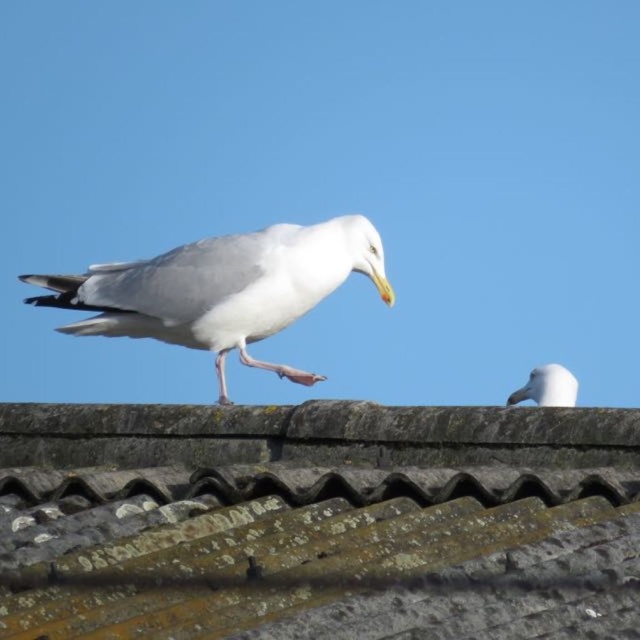
You are a bird looking for a place to land on the roof. The rusty corrugated metal tiles at center are at coordinates point 0.811, 0.497. Are there any seagulls already perched near that location?

The rusty corrugated metal tiles at center are located at point [317,518]. The scene shows two seagulls on the roof, but their exact positions relative to the tiles aren

You are standing on the ground looking at the roof. Which object is closer to you between the rusty corrugated metal tiles at center and the white matte bird at upper center?

The rusty corrugated metal tiles at center is positioned over the white matte bird at upper center, so the white matte bird at upper center is further away and the rusty corrugated metal tiles at center is closer to you.

You are standing in a park and see a seagull perched on a roof. There is a point at coordinates point (374,237) that is 6.59 meters away from you. If you want to throw a piece of bread to the seagull, will the bread reach the seagull if you throw it 6 meters?

The point (374,237) is 6.59 meters away from the viewer. Since the bread is thrown 6 meters, it won not reach the seagull.